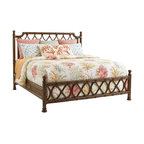
Where is `wooden bed frame`? This screenshot has height=144, width=144. wooden bed frame is located at coordinates (36, 91), (96, 80), (129, 87), (13, 48), (47, 33).